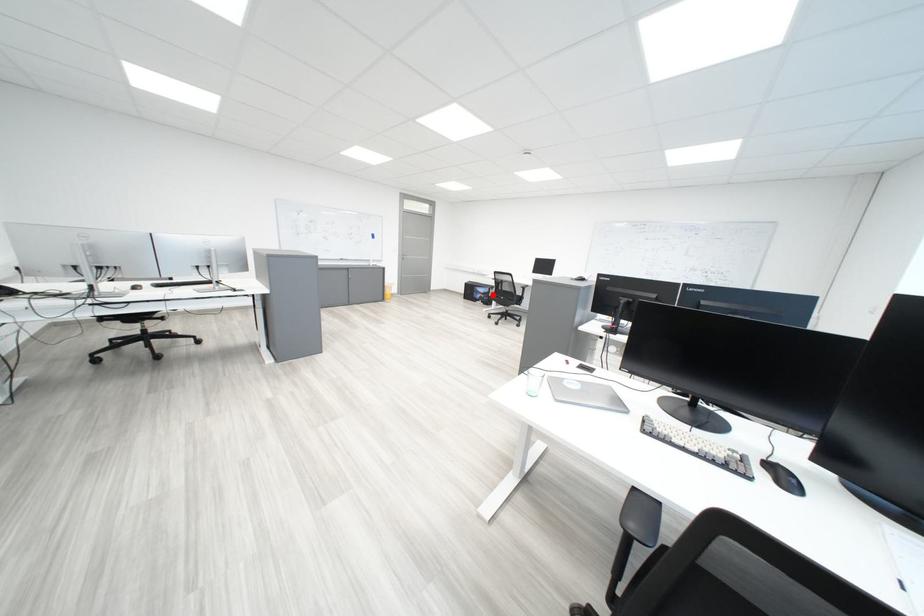
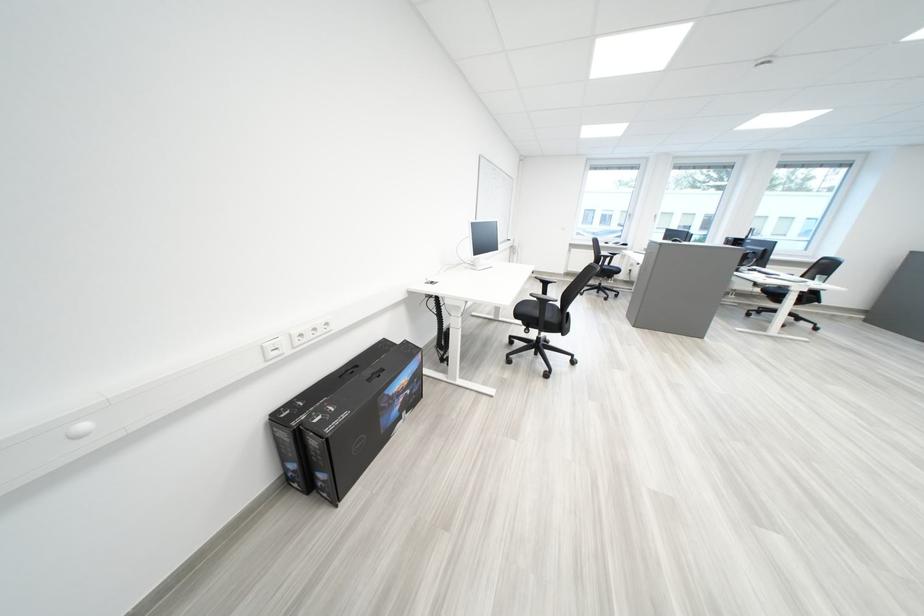
Question: I am providing you with two images of the same scene from different viewpoints. A red point is shown in image1. For the corresponding object point in image2, is it positioned nearer or farther from the camera?

Choices:
 (A) Nearer
 (B) Farther

Answer: (B)